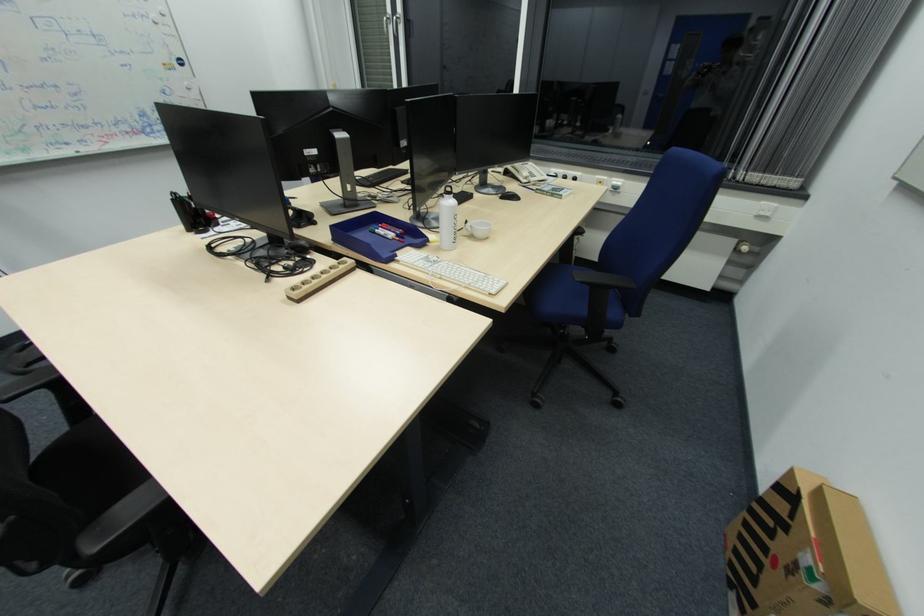
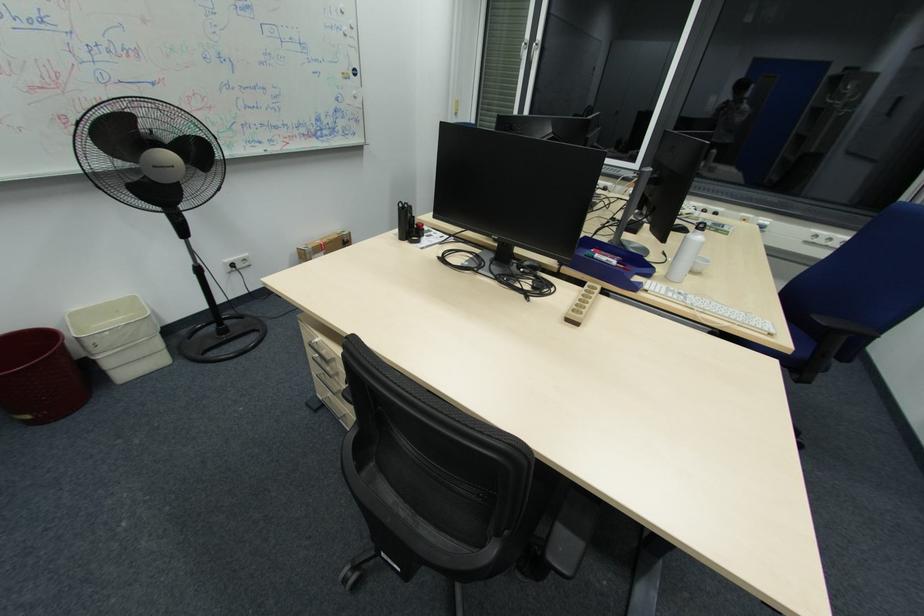
Question: The images are taken continuously from a first-person perspective. In which direction are you moving?

Choices:
 (A) Left
 (B) Right
 (C) Forward
 (D) Backward

Answer: (A)